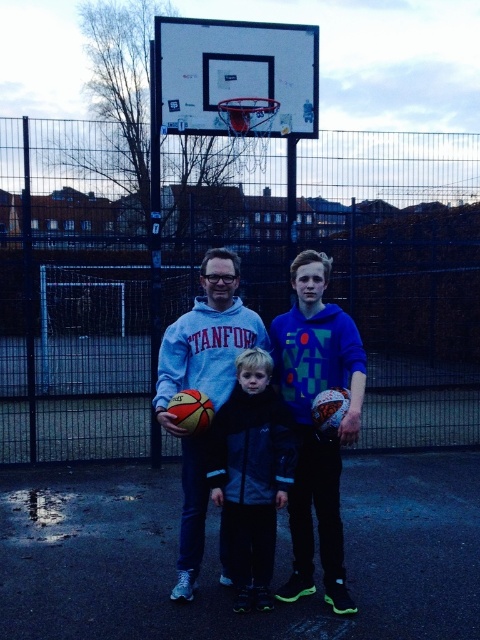
You are a photographer standing at the edge of the basketball court. You want to take a photo that includes both the blue fleece hoodie at center and the matte blue hoodie at center. The minimum distance between the two hoodies in the photo must be at least 18 inches. Do you think the current positioning allows this?

The blue fleece hoodie at center is 17.27 inches from the matte blue hoodie at center, which is less than the required 18 inches. Therefore, the current positioning does not allow the photo to meet the minimum distance requirement.

You are a photographer trying to capture a group photo of the blue fleece hoodie at center and the black matte jacket at center. Since you want to ensure both subjects are in focus, you need to know which one is taller. Which is taller?

The blue fleece hoodie at center is taller than the black matte jacket at center according to the description provided.